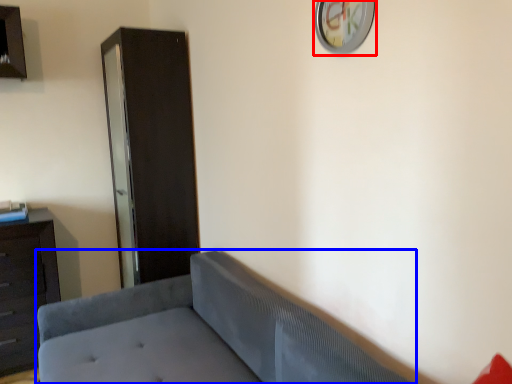
Question: Which of the following is the farthest to the observer, clock (highlighted by a red box) or studio couch (highlighted by a blue box)?

Choices:
 (A) clock
 (B) studio couch

Answer: (A)